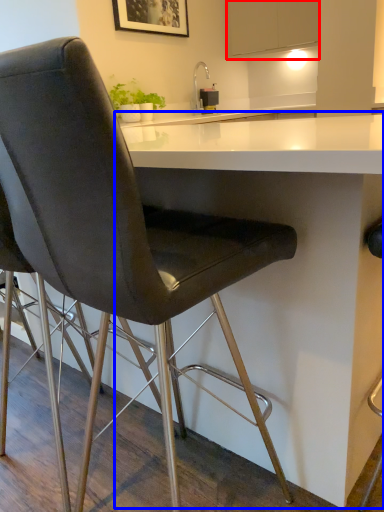
Question: Which point is further to the camera, cabinetry (highlighted by a red box) or table (highlighted by a blue box)?

Choices:
 (A) cabinetry
 (B) table

Answer: (A)